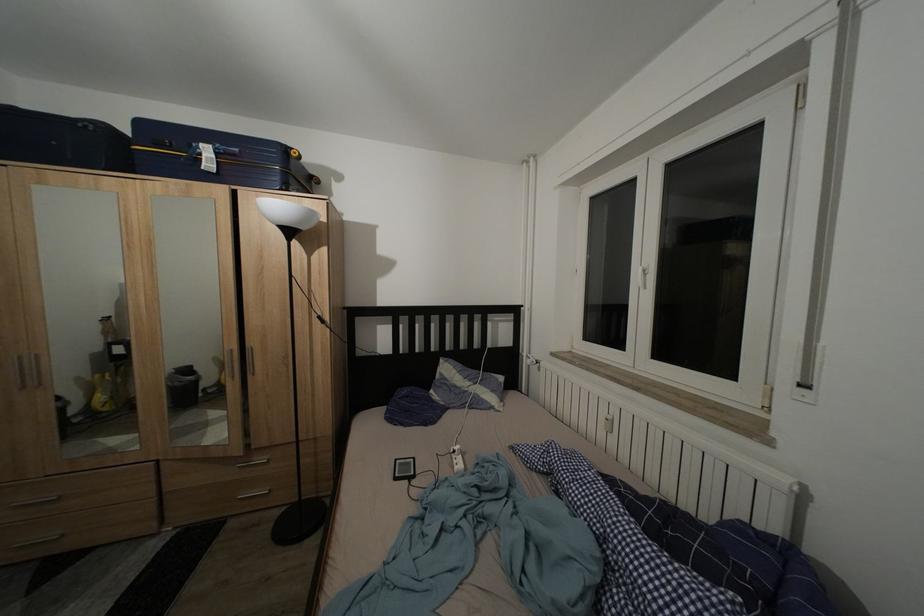
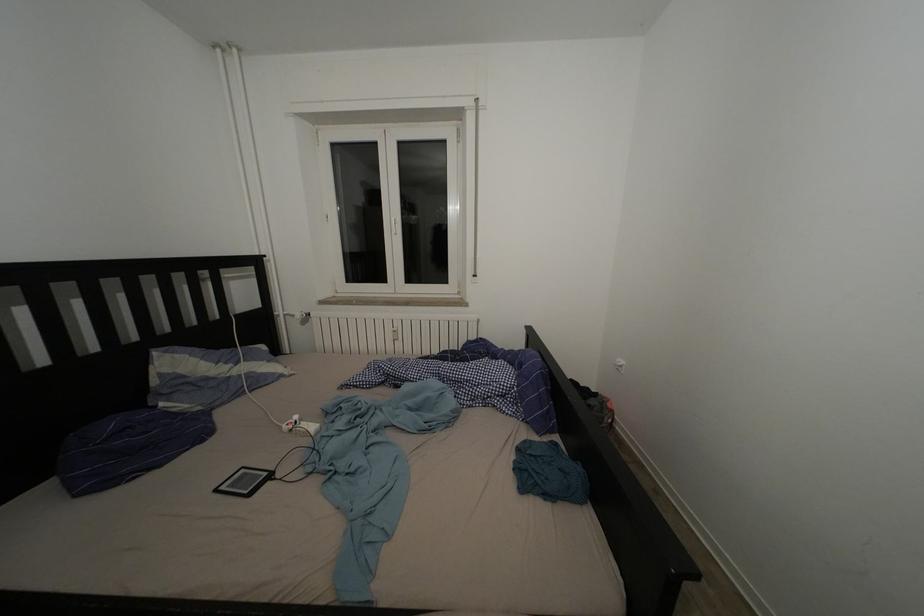
Question: The camera is either moving clockwise (left) or counter-clockwise (right) around the object. The first image is from the beginning of the video and the second image is from the end. Is the camera moving left or right when shooting the video?

Choices:
 (A) Left
 (B) Right

Answer: (A)